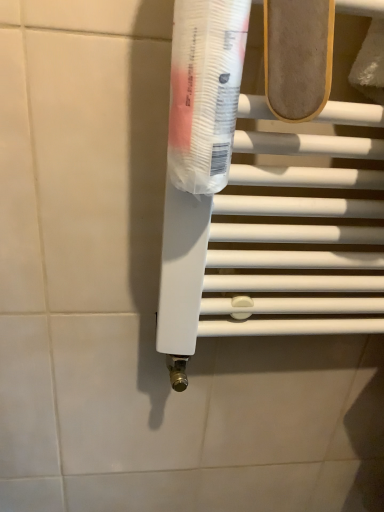
Question: Can you confirm if transparent plastic tube at center is bigger than white plastic towel bar at center?

Choices:
 (A) no
 (B) yes

Answer: (A)

Question: From a real-world perspective, does transparent plastic tube at center sit lower than white plastic towel bar at center?

Choices:
 (A) no
 (B) yes

Answer: (A)

Question: Can you confirm if transparent plastic tube at center is taller than white plastic towel bar at center?

Choices:
 (A) yes
 (B) no

Answer: (B)

Question: Considering the relative sizes of transparent plastic tube at center and white plastic towel bar at center in the image provided, is transparent plastic tube at center shorter than white plastic towel bar at center?

Choices:
 (A) yes
 (B) no

Answer: (A)

Question: Is the position of transparent plastic tube at center less distant than that of white plastic towel bar at center?

Choices:
 (A) yes
 (B) no

Answer: (A)

Question: Is transparent plastic tube at center completely or partially outside of white plastic towel bar at center?

Choices:
 (A) yes
 (B) no

Answer: (A)

Question: From the image's perspective, would you say white plastic towel bar at center is positioned over transparent plastic tube at center?

Choices:
 (A) yes
 (B) no

Answer: (B)

Question: Considering the relative sizes of white plastic towel bar at center and transparent plastic tube at center in the image provided, is white plastic towel bar at center wider than transparent plastic tube at center?

Choices:
 (A) no
 (B) yes

Answer: (A)

Question: Is white plastic towel bar at center thinner than transparent plastic tube at center?

Choices:
 (A) no
 (B) yes

Answer: (B)

Question: From a real-world perspective, is white plastic towel bar at center over transparent plastic tube at center?

Choices:
 (A) no
 (B) yes

Answer: (A)

Question: Is white plastic towel bar at center positioned with its back to transparent plastic tube at center?

Choices:
 (A) yes
 (B) no

Answer: (B)

Question: Is white plastic towel bar at center next to transparent plastic tube at center?

Choices:
 (A) no
 (B) yes

Answer: (A)

Question: Is light brown suede shoe at upper center shorter than white plastic towel bar at center?

Choices:
 (A) no
 (B) yes

Answer: (B)